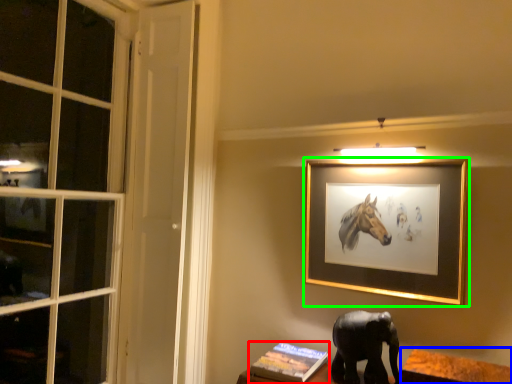
Question: Which is farther away from book (highlighted by a red box)? table (highlighted by a blue box) or picture frame (highlighted by a green box)?

Choices:
 (A) table
 (B) picture frame

Answer: (B)